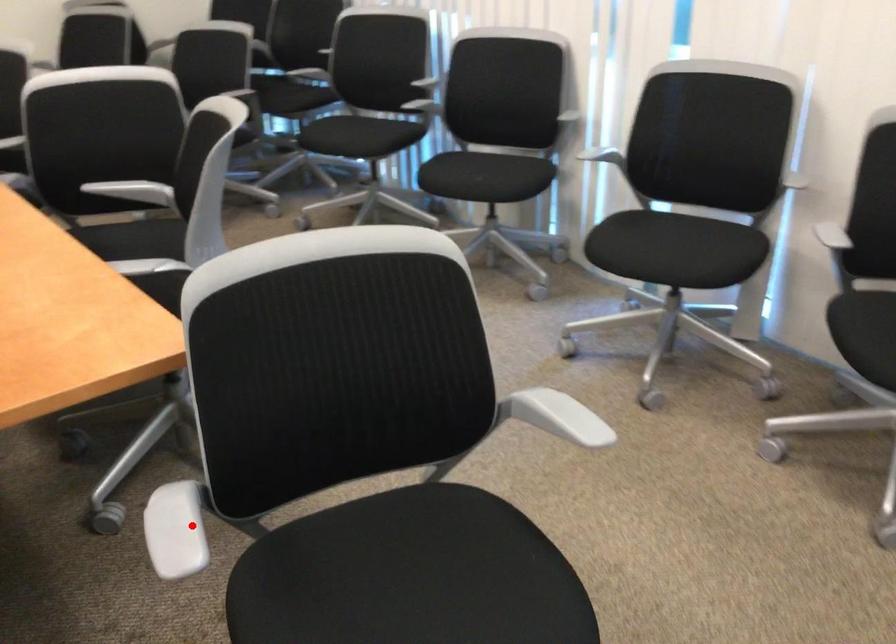
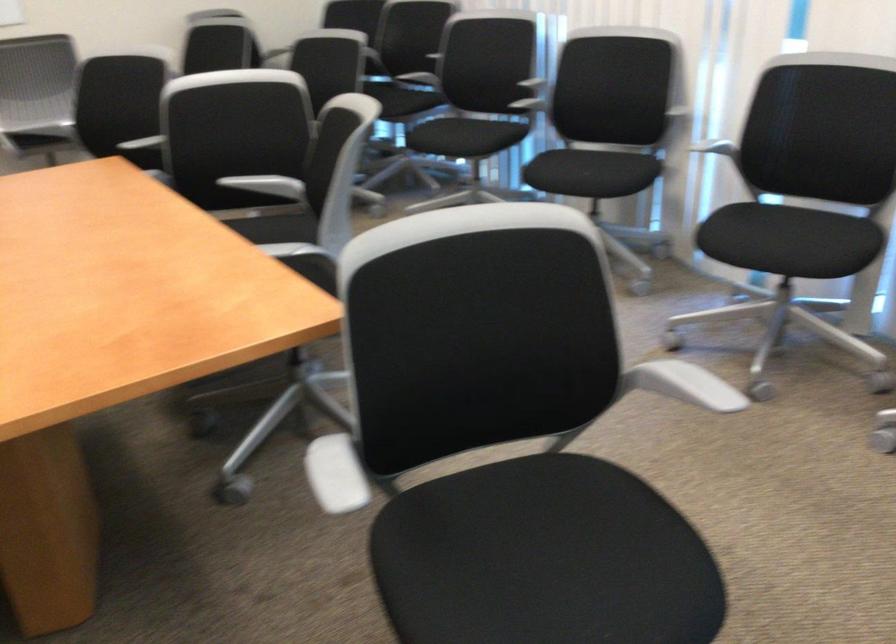
In the second image, find the point that corresponds to the highlighted location in the first image.

(334, 474)